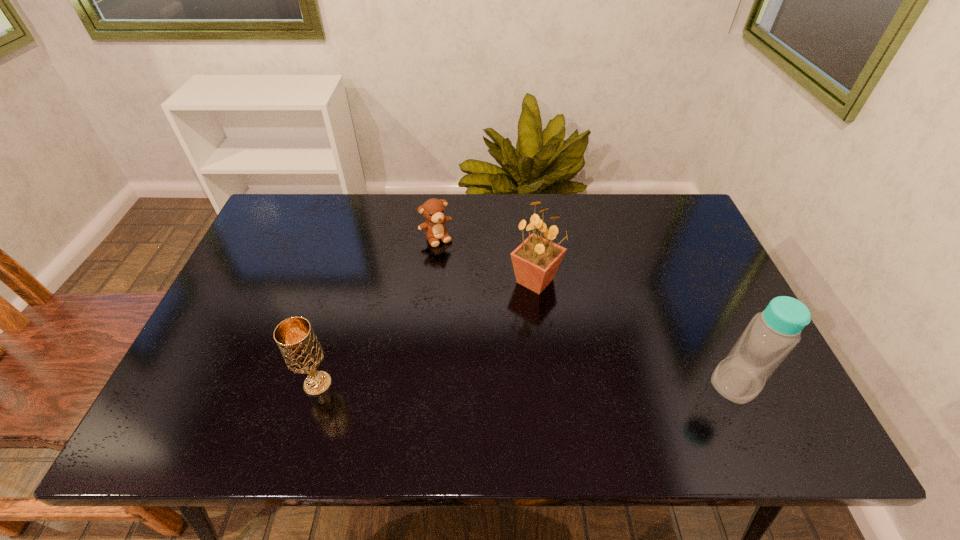
This screenshot has height=540, width=960. What are the coordinates of `the leftmost object` in the screenshot? It's located at (295, 338).

At what (x,y) coordinates should I click in order to perform the action: click on chalice. Please return your answer as a coordinate pair (x, y). The width and height of the screenshot is (960, 540). Looking at the image, I should click on (295, 338).

Find the location of `bottle`. bottle is located at coordinates (771, 335).

This screenshot has width=960, height=540. Find the location of `the second farthest object`. the second farthest object is located at coordinates (536, 260).

Identify the location of sunflower. This screenshot has height=540, width=960. (536, 260).

You are a GUI agent. You are given a task and a screenshot of the screen. Output one action in this format:
    pyautogui.click(x=<x>, y=<y>)
    Task: Click on the farthest object
    
    Given the screenshot: What is the action you would take?
    pyautogui.click(x=433, y=210)

Where is `the shortest object`? The image size is (960, 540). the shortest object is located at coordinates (433, 210).

The width and height of the screenshot is (960, 540). Identify the location of vacant area located on the right of the chalice. (427, 384).

Find the location of `free space located 0.370m on the back of the bottle`. free space located 0.370m on the back of the bottle is located at coordinates (677, 254).

You are a GUI agent. You are given a task and a screenshot of the screen. Output one action in this format:
    pyautogui.click(x=<x>, y=<y>)
    Task: Click on the vacant point located 0.130m at the front of the sunflower with flowers visible
    
    Given the screenshot: What is the action you would take?
    pyautogui.click(x=553, y=340)